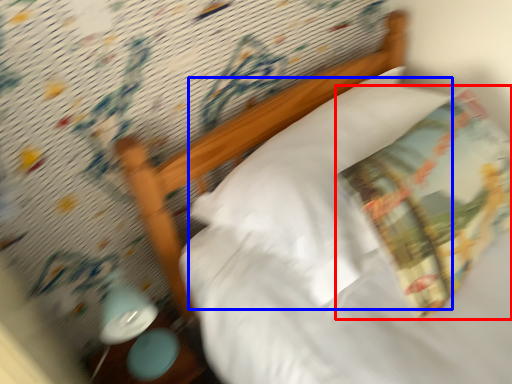
Question: Among these objects, which one is farthest to the camera, throw pillow (highlighted by a red box) or pillow (highlighted by a blue box)?

Choices:
 (A) throw pillow
 (B) pillow

Answer: (B)